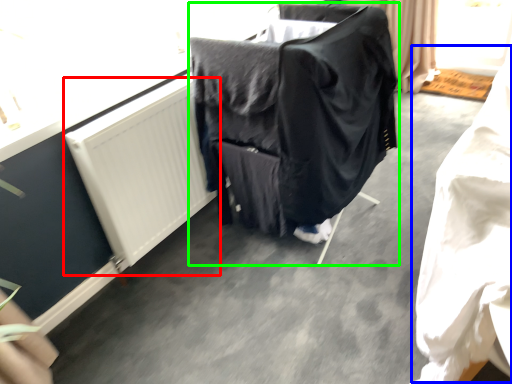
Question: Estimate the real-world distances between objects in this image. Which object is farther from radiator (highlighted by a red box), clothing (highlighted by a blue box) or furniture (highlighted by a green box)?

Choices:
 (A) clothing
 (B) furniture

Answer: (A)